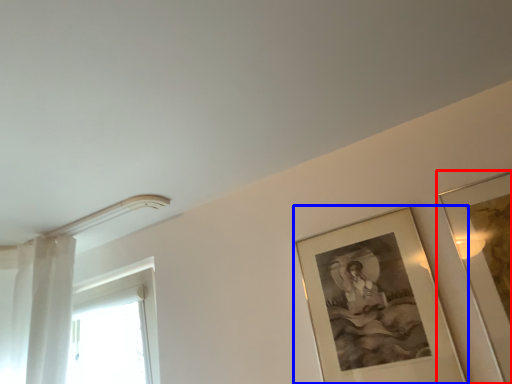
Question: Which of the following is the farthest to the observer, picture frame (highlighted by a red box) or picture frame (highlighted by a blue box)?

Choices:
 (A) picture frame
 (B) picture frame

Answer: (B)